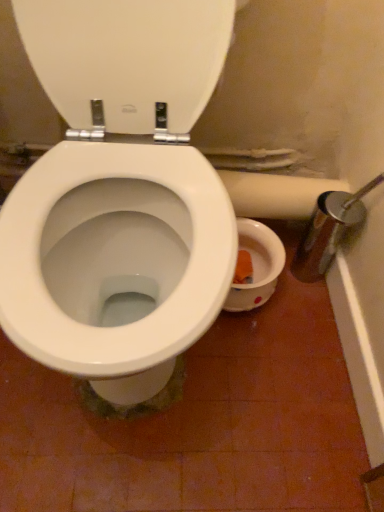
In the scene shown: What is the approximate width of white glossy toilet seat at center?

white glossy toilet seat at center is 2.62 inches wide.

Locate an element on the screen. The image size is (384, 512). white glossy toilet seat at center is located at coordinates click(127, 61).

In order to face white glossy toilet seat at center, should I rotate leftwards or rightwards?

It's best to rotate left around 6.129 degrees.

What do you see at coordinates (127, 61) in the screenshot?
I see `white glossy toilet seat at center` at bounding box center [127, 61].

What are the coordinates of `white matte toilet paper at right` in the screenshot? It's located at (275, 194).

In order to face white matte toilet paper at right, should I rotate leftwards or rightwards?

You should look right and rotate roughly 9.688 degrees.

What do you see at coordinates (275, 194) in the screenshot? The height and width of the screenshot is (512, 384). I see `white matte toilet paper at right` at bounding box center [275, 194].

What are the coordinates of `white glossy toilet seat at center` in the screenshot? It's located at (127, 61).

Is white glossy toilet seat at center at the left side of white matte toilet paper at right?

Yes.

Which object is closer to the camera taking this photo, white glossy toilet seat at center or white matte toilet paper at right?

Positioned in front is white glossy toilet seat at center.

Considering the positions of point (72, 69) and point (244, 192), is point (72, 69) closer or farther from the camera than point (244, 192)?

Point (72, 69).

From the image's perspective, is white glossy toilet seat at center located above or below white matte toilet paper at right?

white glossy toilet seat at center is above white matte toilet paper at right.

From a real-world perspective, does white glossy toilet seat at center sit lower than white matte toilet paper at right?

Actually, white glossy toilet seat at center is physically above white matte toilet paper at right in the real world.

Can you confirm if white glossy toilet seat at center is wider than white matte toilet paper at right?

In fact, white glossy toilet seat at center might be narrower than white matte toilet paper at right.

Between white glossy toilet seat at center and white matte toilet paper at right, which one has more height?

white glossy toilet seat at center is taller.

Does white glossy toilet seat at center have a smaller size compared to white matte toilet paper at right?

Incorrect, white glossy toilet seat at center is not smaller in size than white matte toilet paper at right.

Is white matte toilet paper at right inside white glossy toilet seat at center?

No, white matte toilet paper at right is located outside of white glossy toilet seat at center.

Does white glossy toilet seat at center touch white matte toilet paper at right?

No, white glossy toilet seat at center is not with white matte toilet paper at right.

Could you tell me if white glossy toilet seat at center is turned towards white matte toilet paper at right?

Yes.

How different are the orientations of white glossy toilet seat at center and white matte toilet paper at right in degrees?

There is a 0.0975-degree angle between the facing directions of white glossy toilet seat at center and white matte toilet paper at right.

Identify the location of toilet paper on the right of the white glossy toilet seat at center. The height and width of the screenshot is (512, 384). (275, 194).

Is white matte toilet paper at right to the left or to the right of white glossy toilet seat at center in the image?

In the image, white matte toilet paper at right appears on the right side of white glossy toilet seat at center.

Is white matte toilet paper at right closer to the viewer compared to white glossy toilet seat at center?

No, it is not.

Which point is more forward, (263, 179) or (139, 47)?

The point (139, 47) is in front.

From the image's perspective, does white matte toilet paper at right appear lower than white glossy toilet seat at center?

Indeed, from the image's perspective, white matte toilet paper at right is shown beneath white glossy toilet seat at center.

From a real-world perspective, does white matte toilet paper at right sit lower than white glossy toilet seat at center?

Correct, in the physical world, white matte toilet paper at right is lower than white glossy toilet seat at center.

Considering the sizes of white matte toilet paper at right and white glossy toilet seat at center in the image, is white matte toilet paper at right wider or thinner than white glossy toilet seat at center?

In the image, white matte toilet paper at right appears to be wider than white glossy toilet seat at center.

Considering the relative sizes of white matte toilet paper at right and white glossy toilet seat at center in the image provided, is white matte toilet paper at right shorter than white glossy toilet seat at center?

Yes.

Between white matte toilet paper at right and white glossy toilet seat at center, which one has larger size?

Bigger between the two is white glossy toilet seat at center.

Is white glossy toilet seat at center a part of white matte toilet paper at right?

No, white glossy toilet seat at center is located outside of white matte toilet paper at right.

Is white matte toilet paper at right not close to white glossy toilet seat at center?

That's not correct — white matte toilet paper at right is a little close to white glossy toilet seat at center.

Does white matte toilet paper at right turn towards white glossy toilet seat at center?

No, white matte toilet paper at right is not facing towards white glossy toilet seat at center.

You are a GUI agent. You are given a task and a screenshot of the screen. Output one action in this format:
    pyautogui.click(x=<x>, y=<y>)
    Task: Click on the toilet paper below the white glossy toilet seat at center (from a real-world perspective)
    Image resolution: width=384 pixels, height=512 pixels.
    Given the screenshot: What is the action you would take?
    pyautogui.click(x=275, y=194)

The image size is (384, 512). I want to click on back above the white matte toilet paper at right (from the image's perspective), so click(x=127, y=61).

Find the location of a particular element. The image size is (384, 512). toilet paper below the white glossy toilet seat at center (from the image's perspective) is located at coordinates (275, 194).